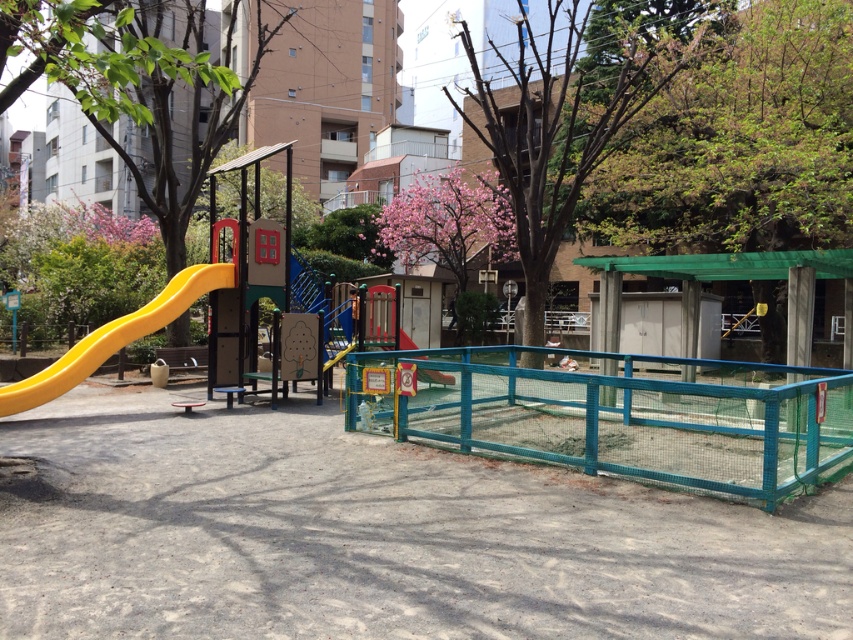
Question: Where is green leafy tree at upper right located in relation to yellow matte slide at left in the image?

Choices:
 (A) right
 (B) left

Answer: (A)

Question: Can you confirm if pink blossom tree at center is positioned below yellow matte slide at center?

Choices:
 (A) no
 (B) yes

Answer: (A)

Question: Is green leafy tree at upper right wider than yellow matte slide at center?

Choices:
 (A) no
 (B) yes

Answer: (B)

Question: Among these objects, which one is nearest to the camera?

Choices:
 (A) green leafy tree at left
 (B) yellow matte slide at left
 (C) green leafy tree at upper right

Answer: (A)

Question: Which point appears closest to the camera in this image?

Choices:
 (A) (175, 300)
 (B) (158, 65)
 (C) (775, 93)
 (D) (630, 13)

Answer: (B)

Question: Estimate the real-world distances between objects in this image. Which object is farther from the bare wood tree at center?

Choices:
 (A) pink blossom tree at center
 (B) green leafy tree at left
 (C) yellow matte slide at center

Answer: (C)